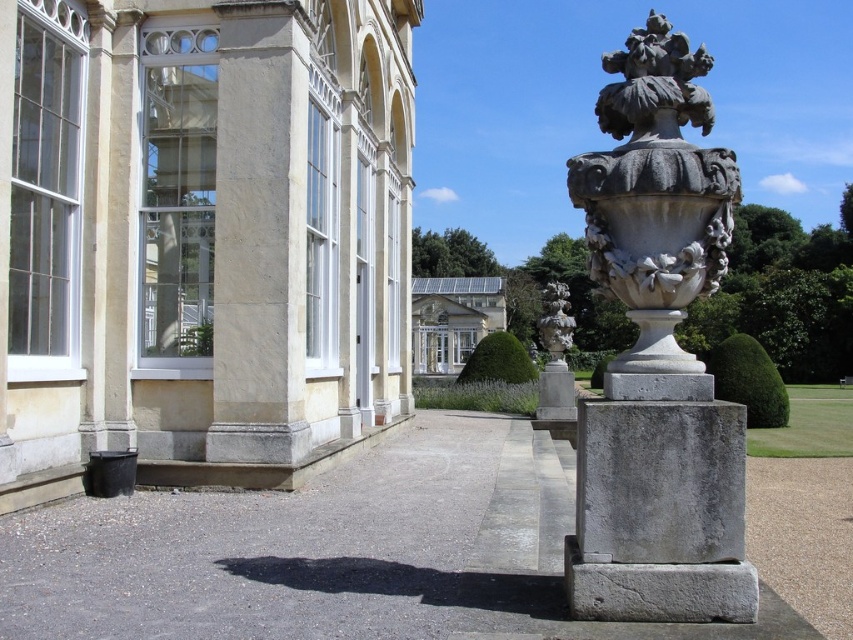
You are standing at the entrance of the classical building and notice two points marked on the ground. The first point is at coordinate point (93, 269), and the second is at point (456, 296). Which point is closer to you as you face the building?

Point (93, 269) is in front of point (456, 296), so it is closer to you as you face the building.

You are standing in front of the grand classical building and want to place a new decorative urn exactly where the white stone vase at center is currently located. What are the coordinates of the location where you should place the new urn?

The coordinates for the white stone vase at center are at point (654,209), so you should place the new urn at those coordinates.

Consider the image. You are an architect examining the grand building. You notice the white stone palace at center and the gray stone vase at center. Which of these two objects is taller?

The white stone palace at center is taller than the gray stone vase at center.